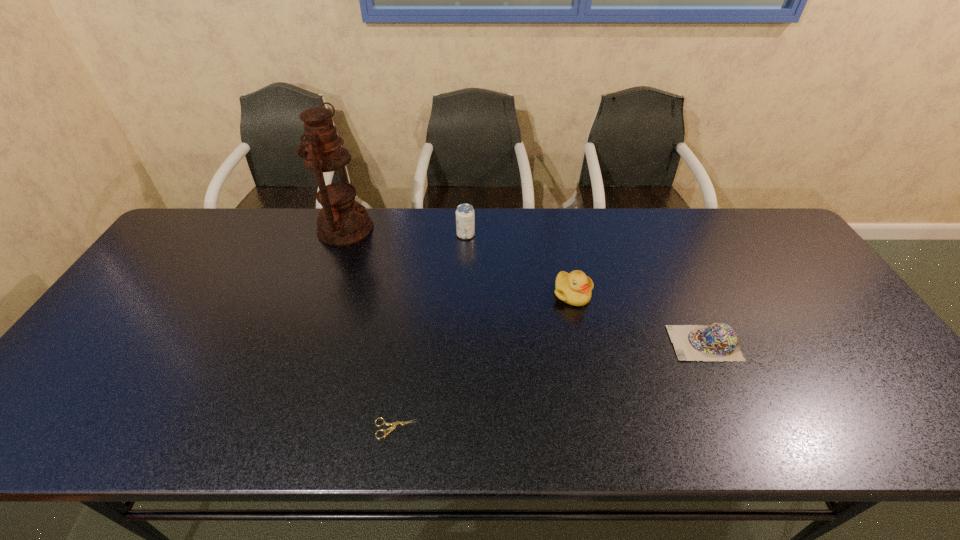
Find the location of a particular element. Image resolution: width=960 pixels, height=540 pixels. free space at the near edge of the desktop is located at coordinates (564, 425).

This screenshot has height=540, width=960. Find the location of `vacant point at the left edge`. vacant point at the left edge is located at coordinates (181, 298).

In the image, there is a desktop. Where is `vacant space at the right edge`? The width and height of the screenshot is (960, 540). vacant space at the right edge is located at coordinates (768, 271).

Identify the location of vacant area at the far left corner of the desktop. The width and height of the screenshot is (960, 540). (227, 228).

The width and height of the screenshot is (960, 540). Find the location of `free region at the far right corner of the desktop`. free region at the far right corner of the desktop is located at coordinates (760, 229).

Find the location of a particular element. vacant space at the near right corner of the desktop is located at coordinates (917, 434).

Locate an element on the screen. The image size is (960, 540). free space between the third tallest object and the soda can is located at coordinates (519, 265).

Identify the location of free space between the fourth object from right to left and the oil lamp. The image size is (960, 540). (371, 329).

Where is `free space between the soda can and the shortest object`? free space between the soda can and the shortest object is located at coordinates (431, 332).

Where is `vacant space that is in between the duckling and the shortest object`? This screenshot has width=960, height=540. vacant space that is in between the duckling and the shortest object is located at coordinates (484, 361).